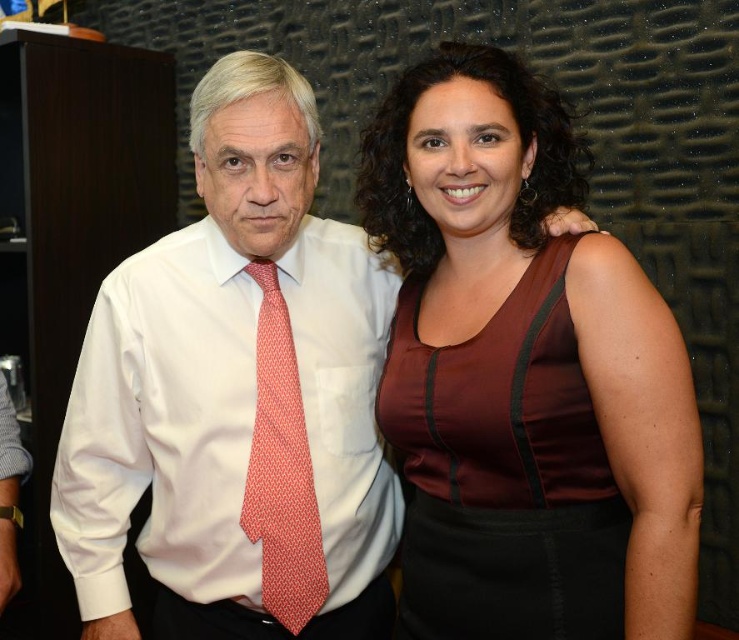
You are a photographer setting up for a portrait. You need to position a spotlight so that it illuminates both the burgundy satin dress at center and the white satin shirt at center equally. Since the dress is to the right of the shirt, where should you place the spotlight relative to the subjects?

The spotlight should be placed to the left of the subjects to ensure both the burgundy satin dress at center and the white satin shirt at center receive equal illumination, as the dress is positioned to the right of the shirt.

You are a photographer setting up for a group photo. You need to ensure that the burgundy satin dress at center and the red dotted fabric tie at center are both clearly visible in the frame. Given their sizes, which object might require more space in the composition to avoid being cropped?

The burgundy satin dress at center requires more space in the composition because its width is larger than the red dotted fabric tie at center, so it needs adequate room to avoid being cropped.

You are a photographer setting up for a close portrait of the two people in the image. You need to ensure that both the white satin shirt at center and the red dotted fabric tie at center are clearly visible in the frame. Given their relative widths, which item requires more horizontal space in the composition to avoid being cut off?

The white satin shirt at center requires more horizontal space in the composition because its width surpasses that of the red dotted fabric tie at center.